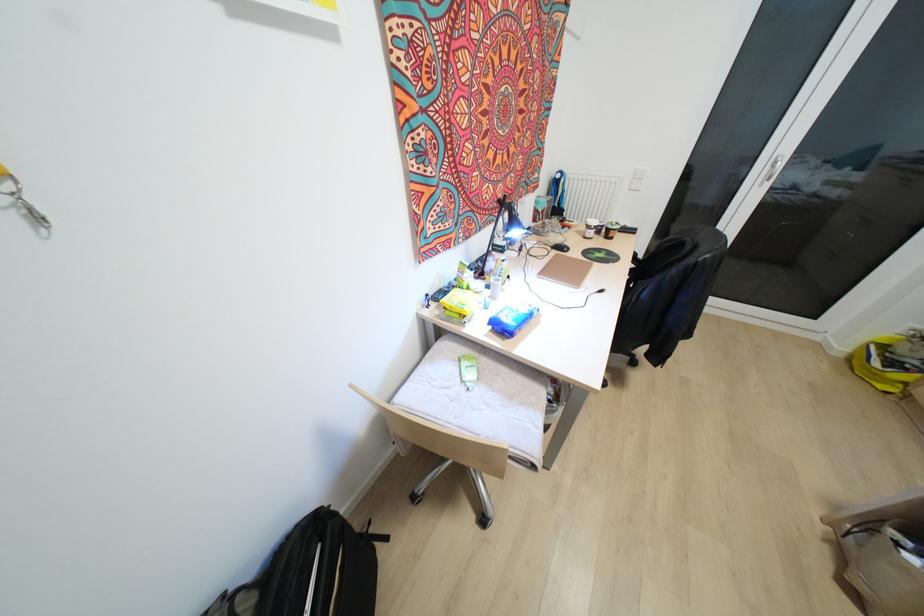
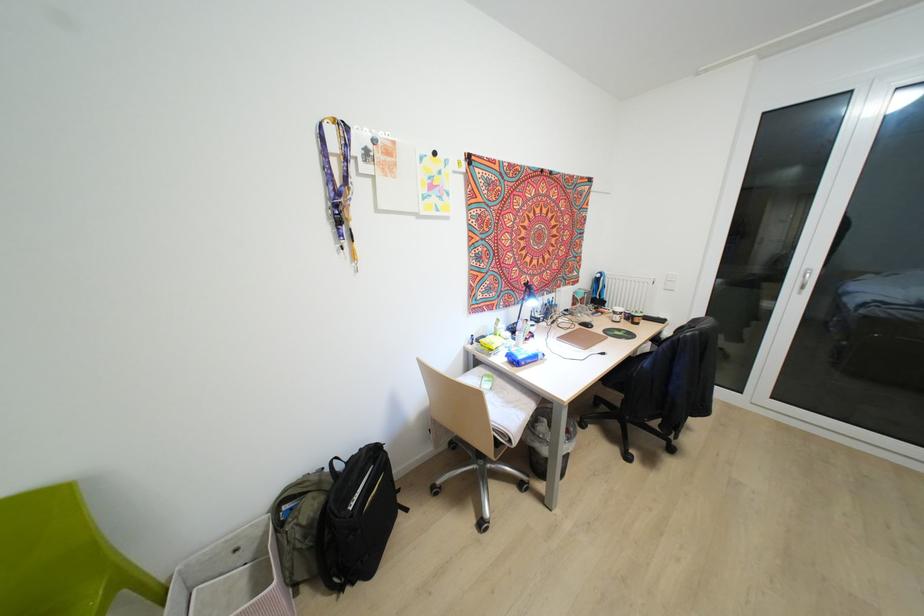
Find the pixel in the second image that matches (518,200) in the first image.

(556, 289)